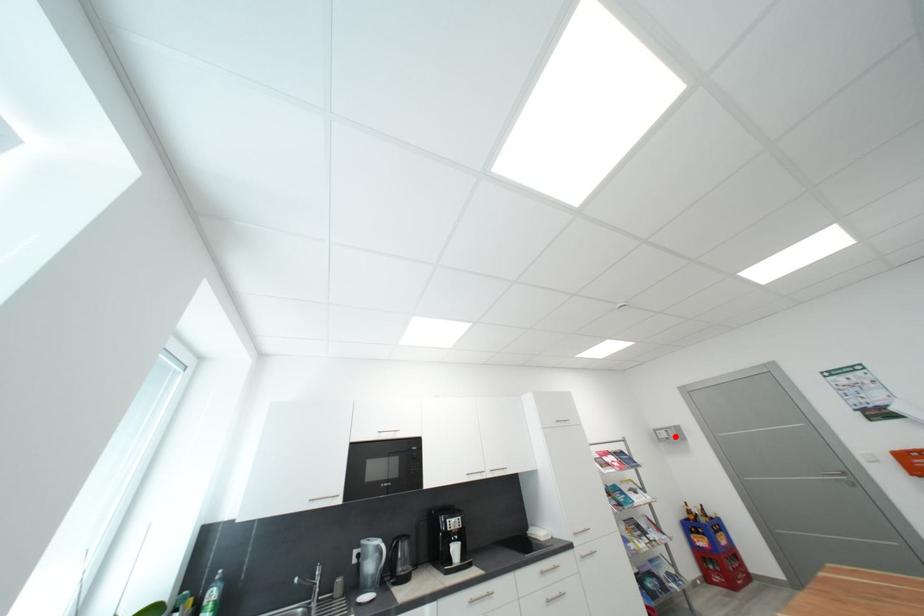
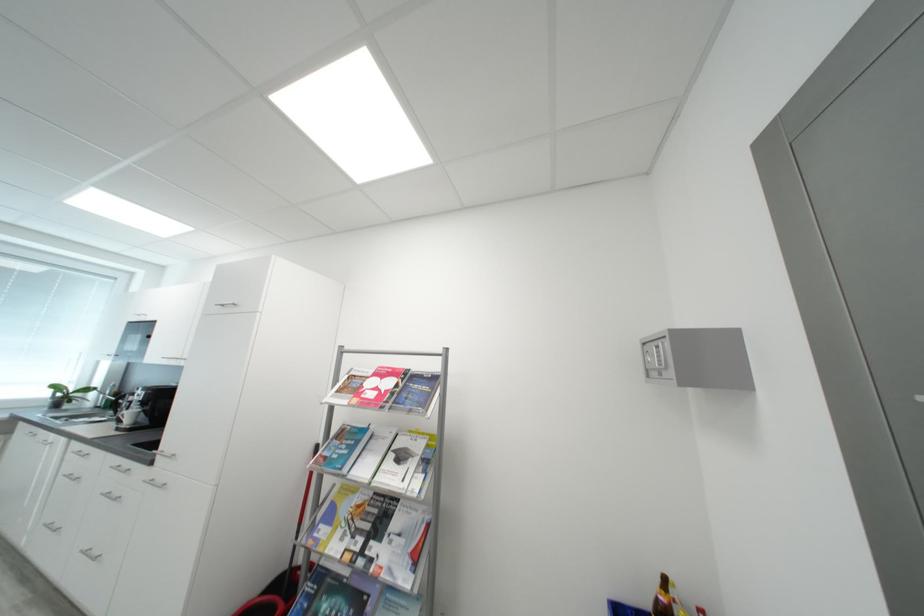
In the second image, find the point that corresponds to the highlighted location in the first image.

(666, 362)